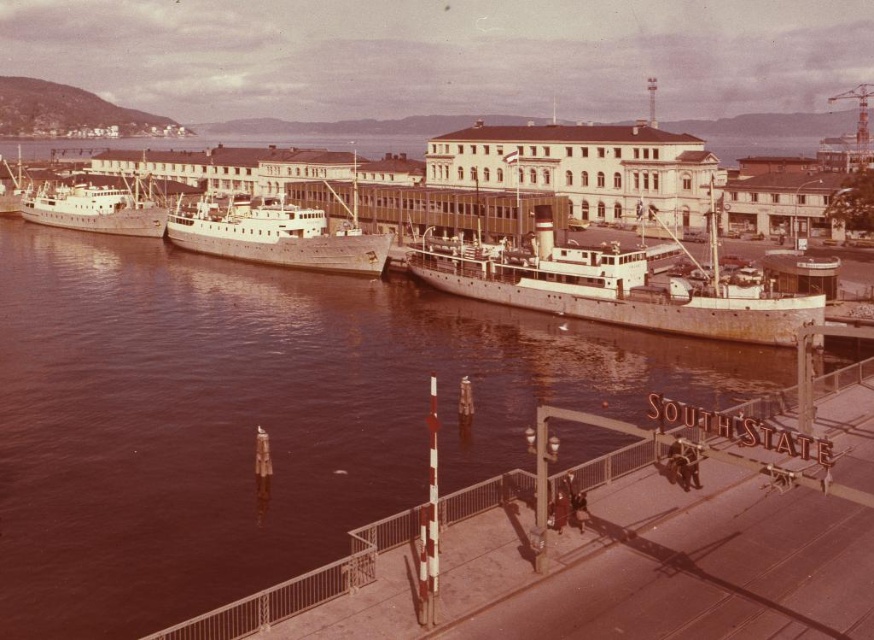
Question: Is brown water at center wider than white matte ship at left?

Choices:
 (A) no
 (B) yes

Answer: (B)

Question: Considering the real-world distances, which object is closest to the white matte ship at left?

Choices:
 (A) brown water at center
 (B) white matte ship at center

Answer: (A)

Question: Among these points, which one is nearest to the camera?

Choices:
 (A) (265, 220)
 (B) (47, 202)
 (C) (739, 326)
 (D) (121, 369)

Answer: (D)

Question: Does brown water at center have a greater width compared to white matte ship at center?

Choices:
 (A) yes
 (B) no

Answer: (A)

Question: Based on their relative distances, which object is nearer to the metallic gray ship at center?

Choices:
 (A) brown water at center
 (B) white matte ship at left

Answer: (A)

Question: Does white matte ship at center appear over metallic gray ship at center?

Choices:
 (A) no
 (B) yes

Answer: (A)